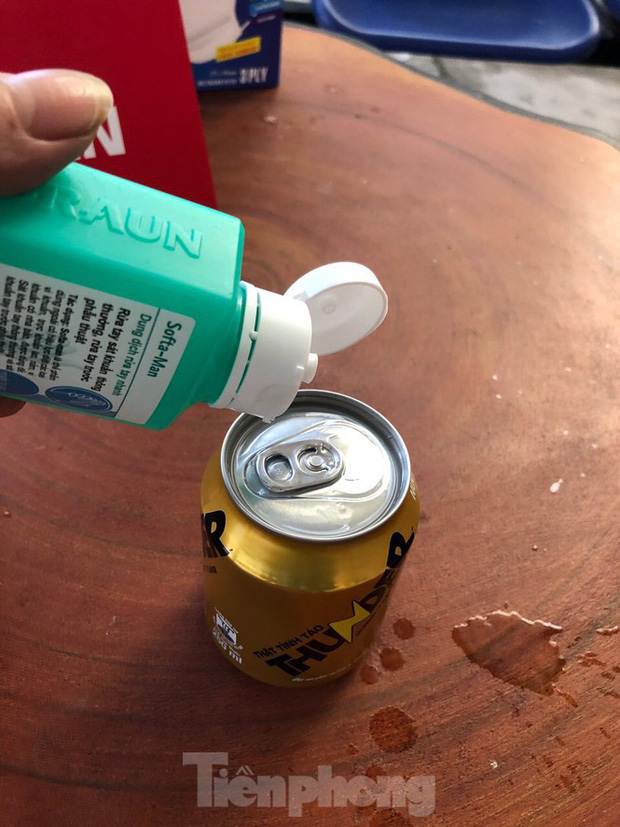
At what (x,y) coordinates should I click in order to perform the action: click on brown wooden table. Please return your answer as a coordinate pair (x, y). Image resolution: width=620 pixels, height=827 pixels. Looking at the image, I should click on (x=175, y=696).